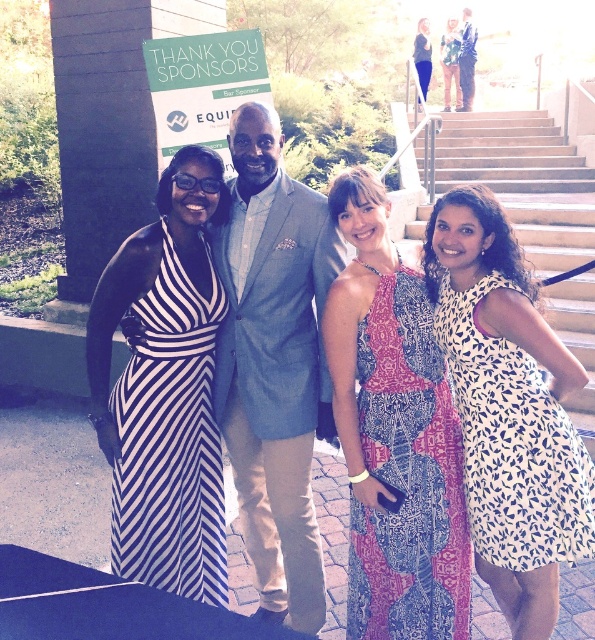
Question: Which point is closer to the camera?

Choices:
 (A) (446, 444)
 (B) (201, 296)
 (C) (540, 426)

Answer: (C)

Question: Which of the following is the closest to the observer?

Choices:
 (A) (173, 324)
 (B) (458, 400)

Answer: (B)

Question: Is light blue textured suit at center thinner than light beige stone stairs at upper right?

Choices:
 (A) yes
 (B) no

Answer: (A)

Question: Is light blue textured suit at center further to camera compared to black and white striped dress at left?

Choices:
 (A) yes
 (B) no

Answer: (A)

Question: Does black and white striped dress at left have a larger size compared to matte black dress at upper center?

Choices:
 (A) no
 (B) yes

Answer: (A)

Question: Which object appears farthest from the camera in this image?

Choices:
 (A) patterned fabric dress at center
 (B) black and white striped dress at left

Answer: (B)